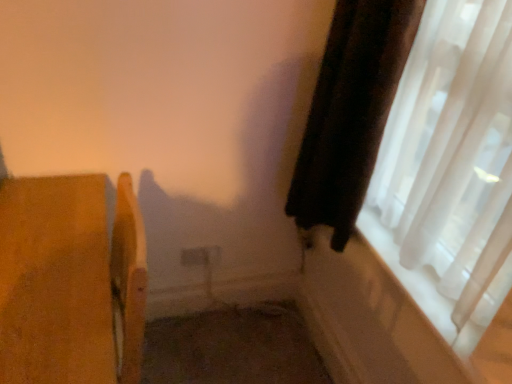
Question: Should I look upward or downward to see velvet dark brown curtain at right?

Choices:
 (A) up
 (B) down

Answer: (A)

Question: Is wooden chair at left positioned far away from velvet dark brown curtain at right?

Choices:
 (A) yes
 (B) no

Answer: (B)

Question: Is wooden chair at left outside velvet dark brown curtain at right?

Choices:
 (A) no
 (B) yes

Answer: (B)

Question: From a real-world perspective, is wooden chair at left physically above velvet dark brown curtain at right?

Choices:
 (A) yes
 (B) no

Answer: (B)

Question: Would you say wooden chair at left contains velvet dark brown curtain at right?

Choices:
 (A) no
 (B) yes

Answer: (A)

Question: Considering the relative sizes of wooden chair at left and velvet dark brown curtain at right in the image provided, is wooden chair at left thinner than velvet dark brown curtain at right?

Choices:
 (A) no
 (B) yes

Answer: (A)

Question: Is wooden chair at left facing away from velvet dark brown curtain at right?

Choices:
 (A) yes
 (B) no

Answer: (A)

Question: Is velvet dark brown curtain at right oriented towards translucent white curtain at right?

Choices:
 (A) no
 (B) yes

Answer: (B)

Question: Does velvet dark brown curtain at right have a greater width compared to translucent white curtain at right?

Choices:
 (A) yes
 (B) no

Answer: (A)

Question: Is velvet dark brown curtain at right far away from translucent white curtain at right?

Choices:
 (A) no
 (B) yes

Answer: (A)

Question: Is velvet dark brown curtain at right shorter than translucent white curtain at right?

Choices:
 (A) yes
 (B) no

Answer: (B)

Question: Can you confirm if velvet dark brown curtain at right is positioned to the right of translucent white curtain at right?

Choices:
 (A) no
 (B) yes

Answer: (A)

Question: Can you confirm if velvet dark brown curtain at right is smaller than translucent white curtain at right?

Choices:
 (A) no
 (B) yes

Answer: (B)

Question: Considering the relative positions of translucent white curtain at right and velvet dark brown curtain at right in the image provided, is translucent white curtain at right to the left of velvet dark brown curtain at right from the viewer's perspective?

Choices:
 (A) yes
 (B) no

Answer: (B)